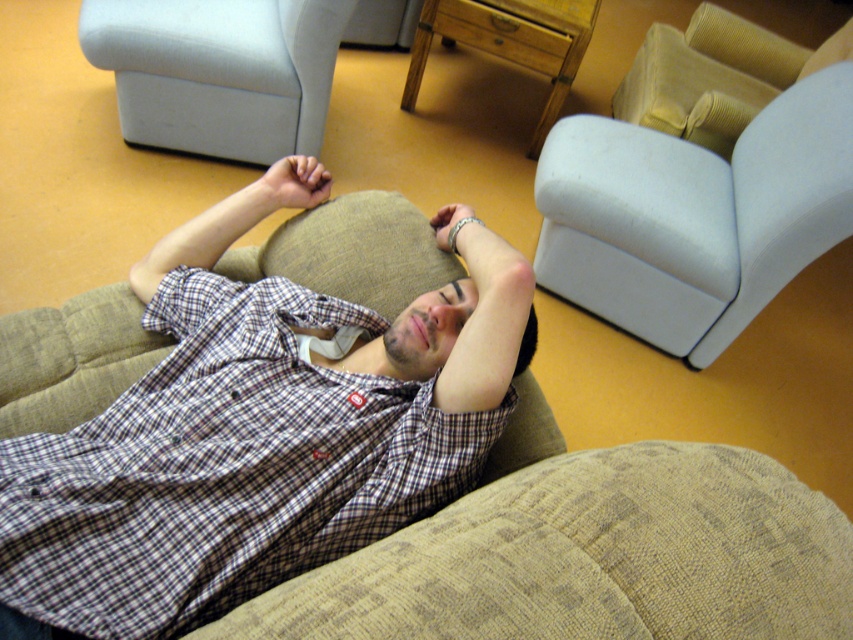
You are organizing a small party and need to know if the checkered fabric shirt at center and the textured beige armchair at upper right can fit on a table that can hold items totaling up to 1.5 square meters. What should you consider?

The checkered fabric shirt at center occupies less space than the textured beige armchair at upper right. To determine if they can fit together on the table, calculate the combined area of both items. If their total area is under 1.5 square meters, they can fit. However, if the armchair alone exceeds the table capacity, they might not fit together.

You are a photographer trying to capture a closeup of the checkered fabric shirt at center. The camera you are using has a focal length of 50mm and an aperture of f2.8. You want to ensure that the entire shirt is in focus while maintaining a shallow depth of field. Based on the shirt position at point 0.672, 0.304, where should you focus the camera to achieve this?

To ensure the entire checkered fabric shirt at center is in focus with a shallow depth of field, focus the camera at the shirt position at point (258, 429). This point is the optimal focus point as it aligns with the shirt, maximizing sharpness while maintaining the desired depth of field.